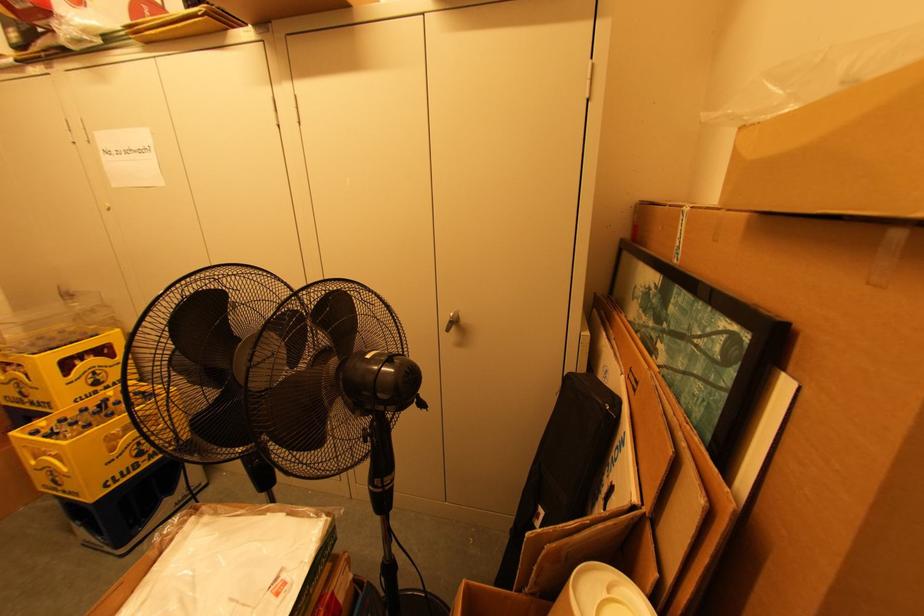
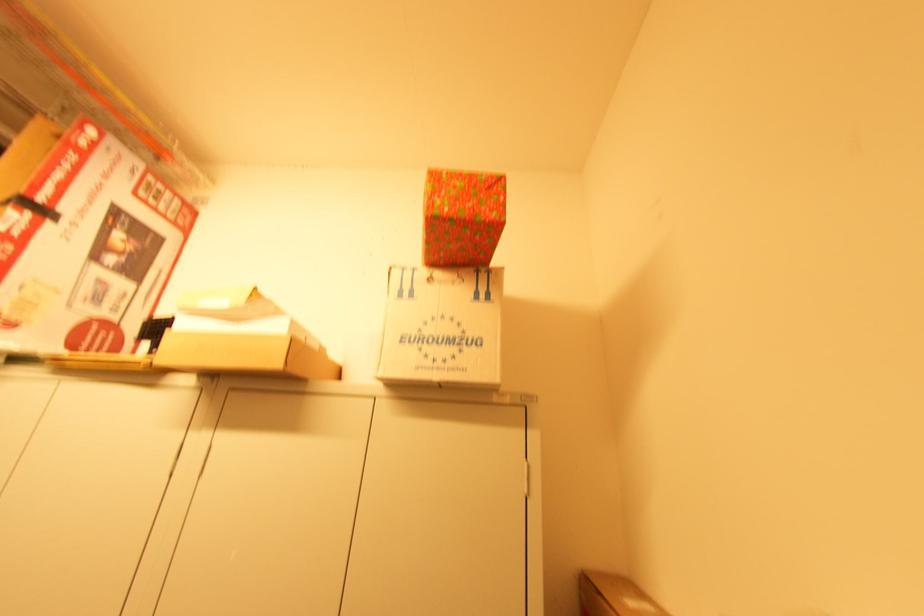
Question: The first image is from the beginning of the video and the second image is from the end. How did the camera likely rotate when shooting the video?

Choices:
 (A) Left
 (B) Right
 (C) Up
 (D) Down

Answer: (C)